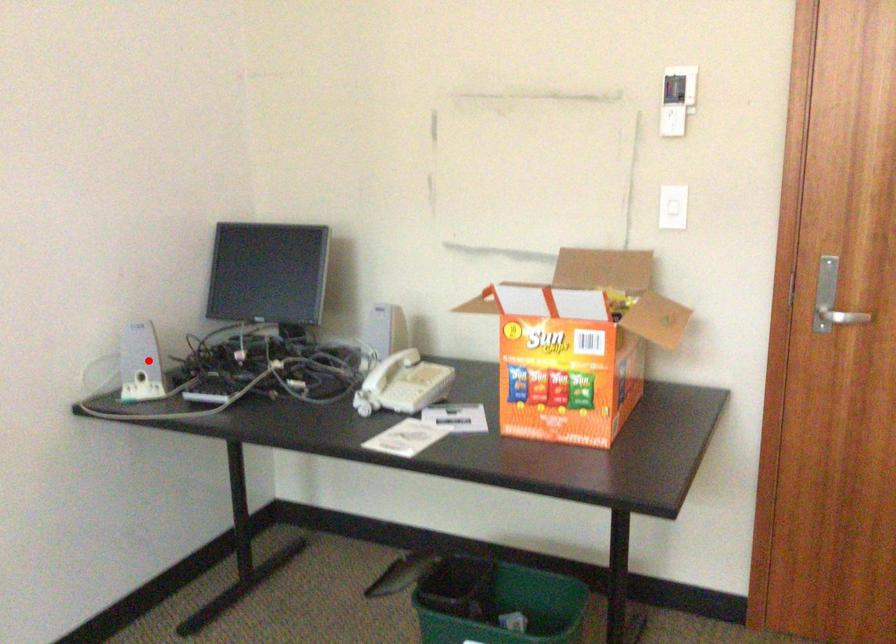
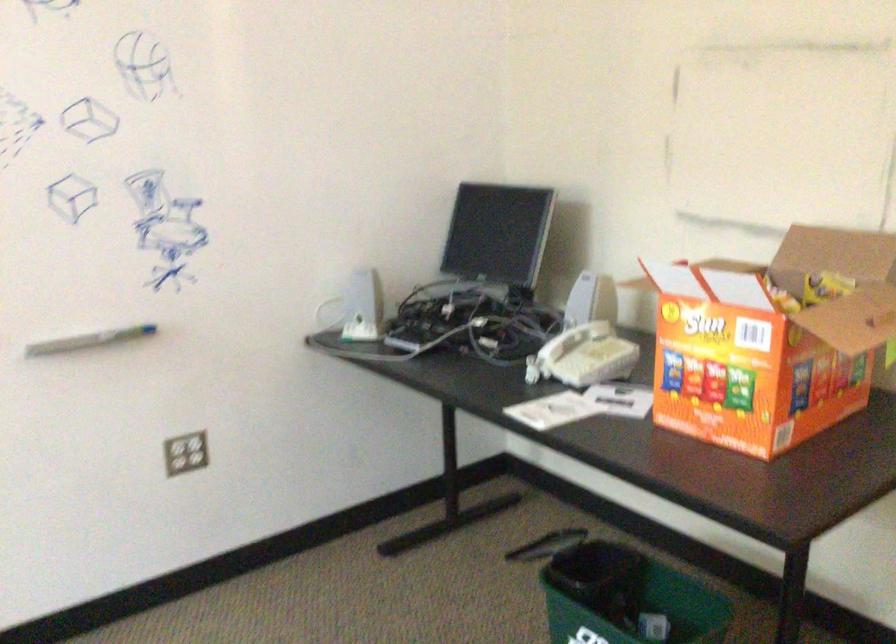
Question: I am providing you with two images of the same scene from different viewpoints. Given a red point in image1, look at the same physical point in image2. Is it:

Choices:
 (A) Closer to the viewpoint
 (B) Farther from the viewpoint

Answer: (B)